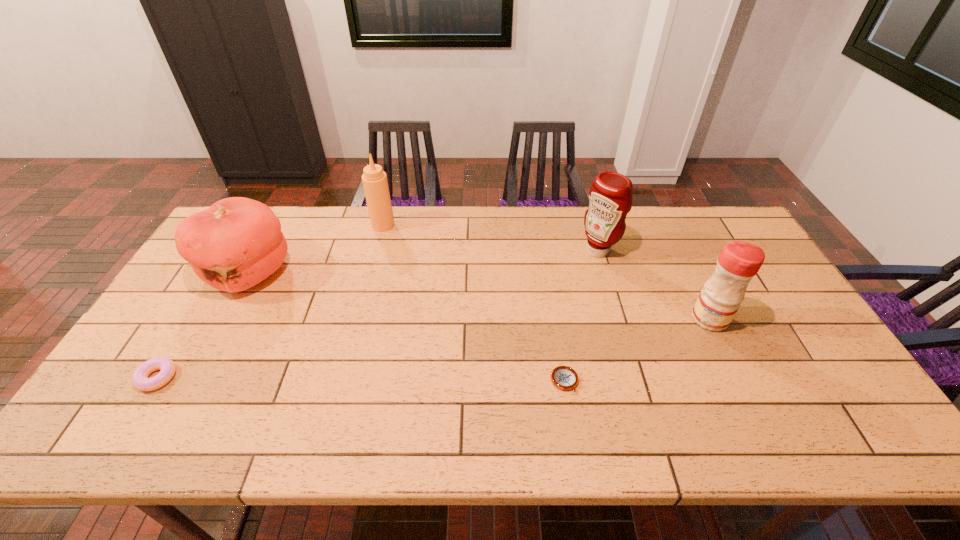
Identify the location of the farthest condiment. (374, 179).

Where is `the farthest object`? Image resolution: width=960 pixels, height=540 pixels. the farthest object is located at coordinates (374, 179).

Locate an element on the screen. The image size is (960, 540). the second nearest condiment is located at coordinates (611, 194).

This screenshot has height=540, width=960. Identify the location of the fifth object from left to right. (611, 194).

I want to click on the rightmost condiment, so click(719, 300).

Identify the location of the fourth farthest object. Image resolution: width=960 pixels, height=540 pixels. (719, 300).

Locate an element on the screen. The image size is (960, 540). pumpkin is located at coordinates (235, 244).

Find the location of `doughnut`. doughnut is located at coordinates (140, 380).

Image resolution: width=960 pixels, height=540 pixels. In order to click on the shortest object in this screenshot , I will do `click(563, 377)`.

The height and width of the screenshot is (540, 960). In order to click on the fourth object from left to right in this screenshot , I will do `click(563, 377)`.